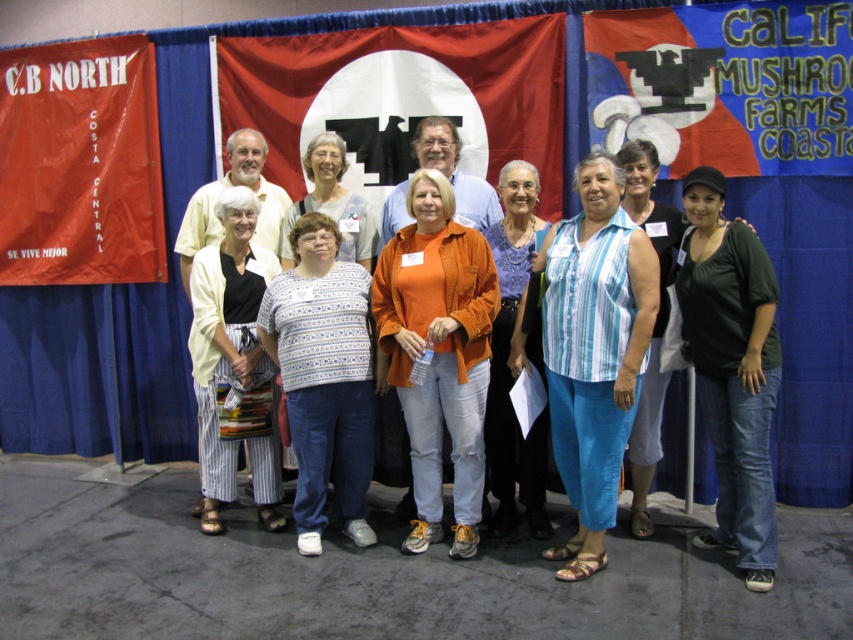
You are standing 2 meters away from the backdrop. If you want to touch the dark green jersey at center without moving your feet, is it possible?

The dark green jersey at center is 3.15 meters away from the viewer, which is farther than your current distance of 2 meters from the backdrop. Therefore, you cannot reach it without moving.

You are a photographer trying to adjust the focus of your camera. You notice two people in the front row wearing a dark green jersey at center and a white striped sweater at center. Which clothing item is closer to you, the photographer?

The dark green jersey at center is closer to the viewer than the white striped sweater at center, so the dark green jersey at center is closer to you.

You are a photographer adjusting the lighting for the group photo. You notice the blue striped tank top at center and the striped cotton pants at center. Which clothing item requires more light to ensure it stands out, considering their sizes?

The blue striped tank top at center requires more light because its width is larger than the striped cotton pants at center, making it need more illumination to stand out properly.